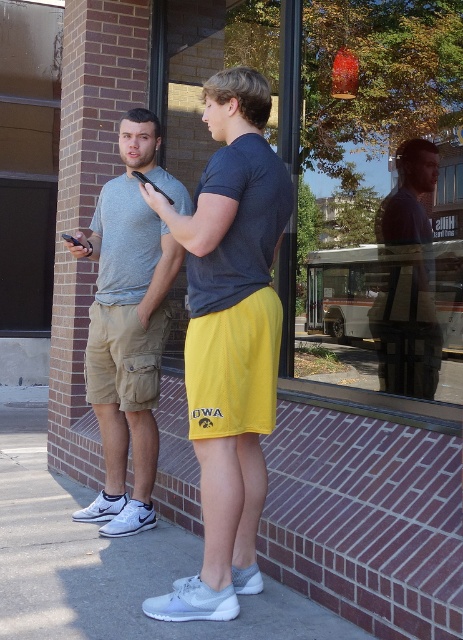
Which of these two, yellow athletic shorts at center or matte khaki shorts at left, stands taller?

matte khaki shorts at left

Between yellow athletic shorts at center and matte khaki shorts at left, which one appears on the right side from the viewer's perspective?

From the viewer's perspective, yellow athletic shorts at center appears more on the right side.

Find the location of `yellow athletic shorts at center`. yellow athletic shorts at center is located at coordinates (230, 339).

Is yellow athletic shorts at center wider than matte gray shirt at center?

Yes.

At what (x,y) coordinates should I click in order to perform the action: click on yellow athletic shorts at center. Please return your answer as a coordinate pair (x, y). The height and width of the screenshot is (640, 463). Looking at the image, I should click on (230, 339).

Find the location of a particular element. This screenshot has height=640, width=463. yellow athletic shorts at center is located at coordinates (230, 339).

This screenshot has width=463, height=640. Describe the element at coordinates (110, 563) in the screenshot. I see `white rubber shoe at lower center` at that location.

Identify the location of white rubber shoe at lower center. (110, 563).